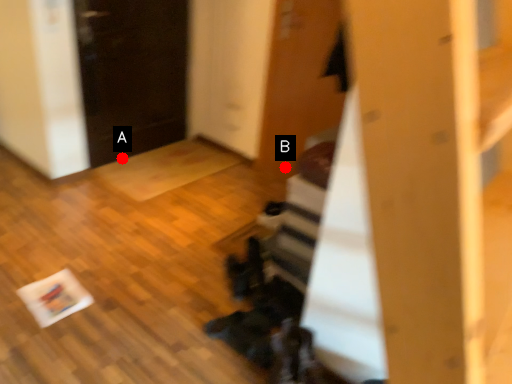
Question: Two points are circled on the image, labeled by A and B beside each circle. Which point appears farthest from the camera in this image?

Choices:
 (A) A is further
 (B) B is further

Answer: (A)